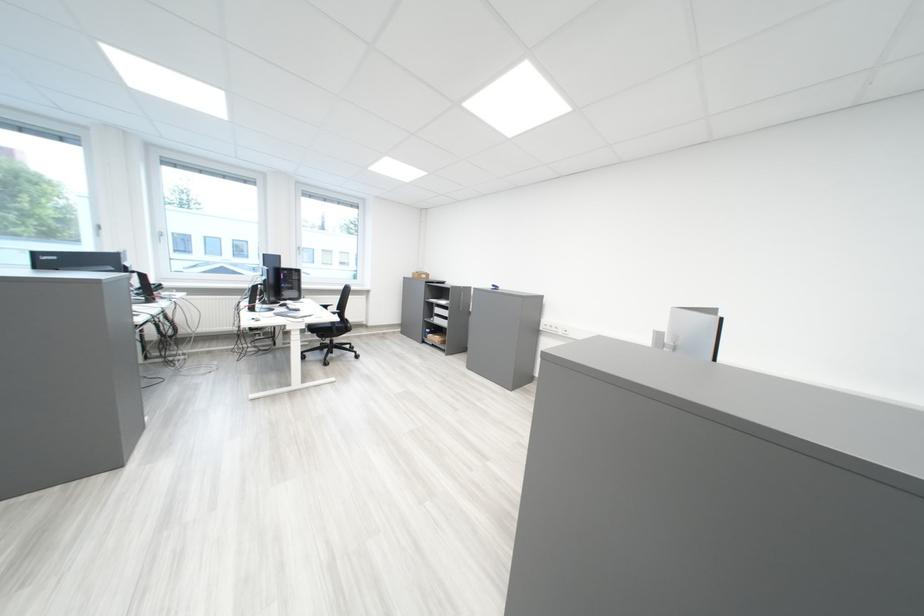
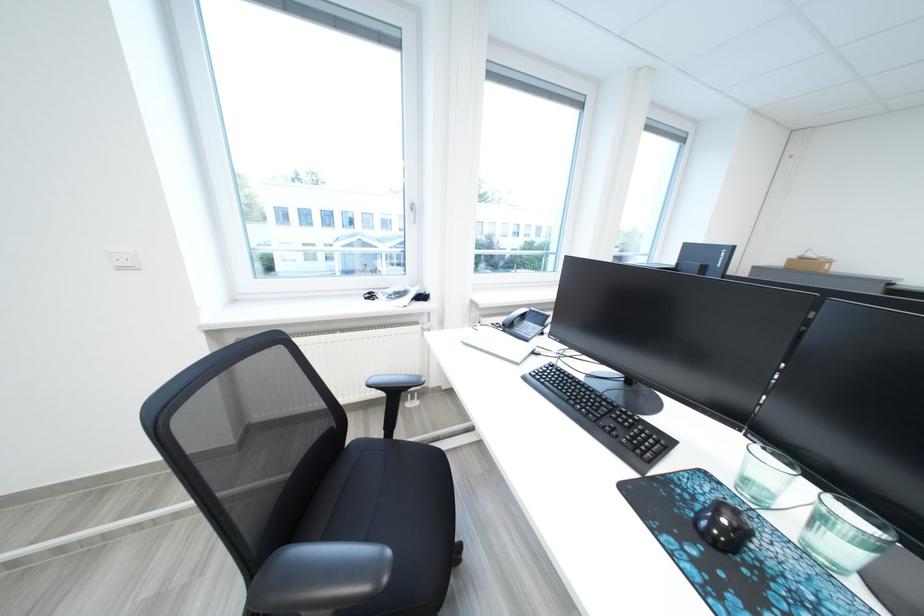
The images are taken continuously from a first-person perspective. In which direction are you moving?

The cameraman walked toward left, forward.